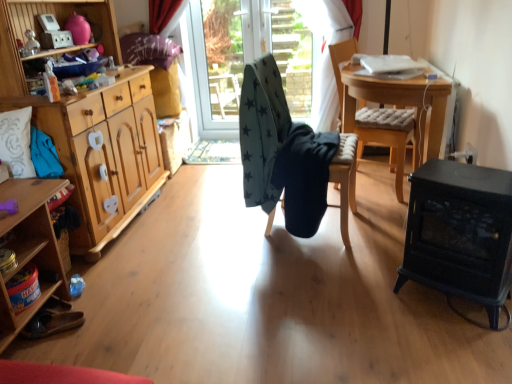
Identify the location of vacant area that lies between black cast iron fireplace at lower right and brown leather shoes at lower left. This screenshot has width=512, height=384. (272, 308).